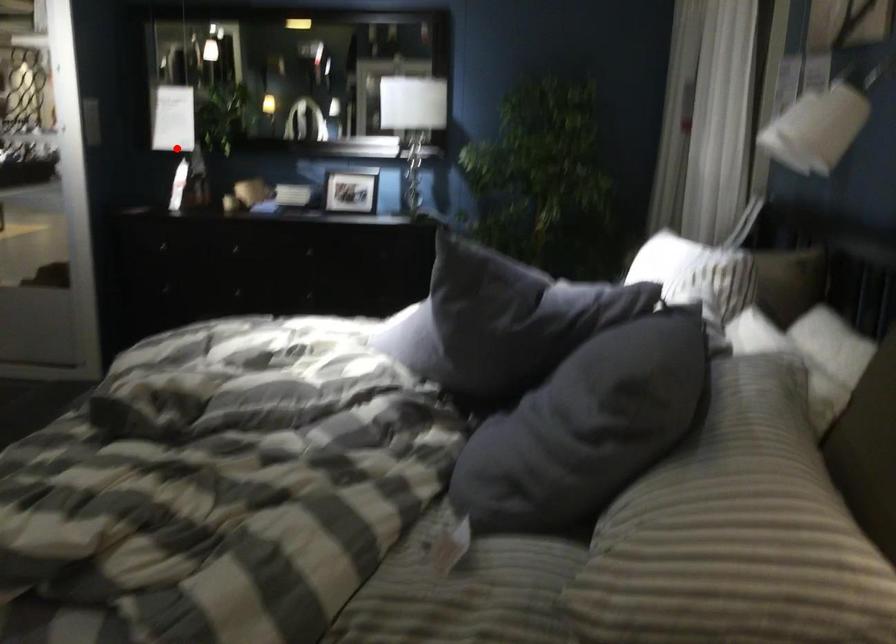
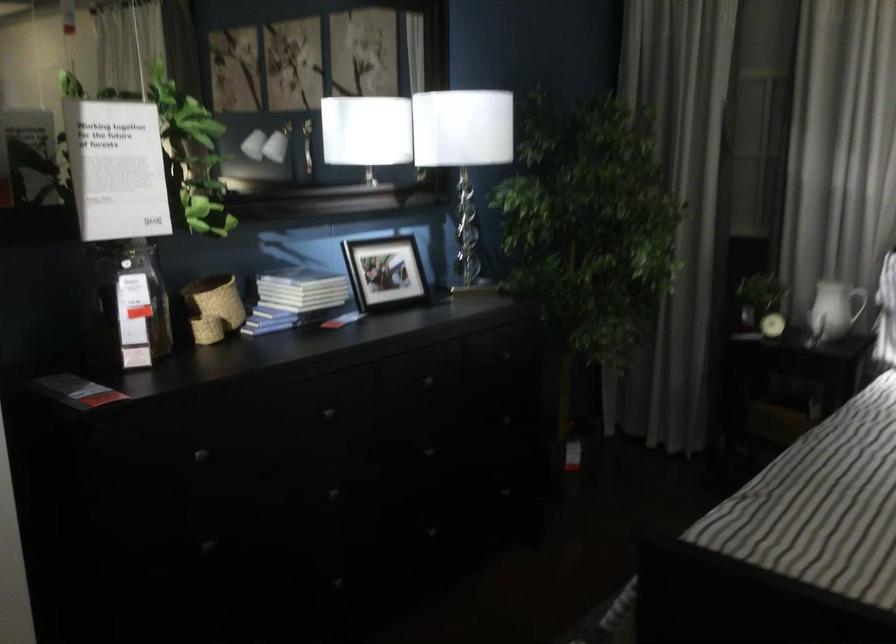
Question: I am providing you with two images of the same scene from different viewpoints. Given a red point in image1, look at the same physical point in image2. Is it:

Choices:
 (A) Closer to the viewpoint
 (B) Farther from the viewpoint

Answer: (A)